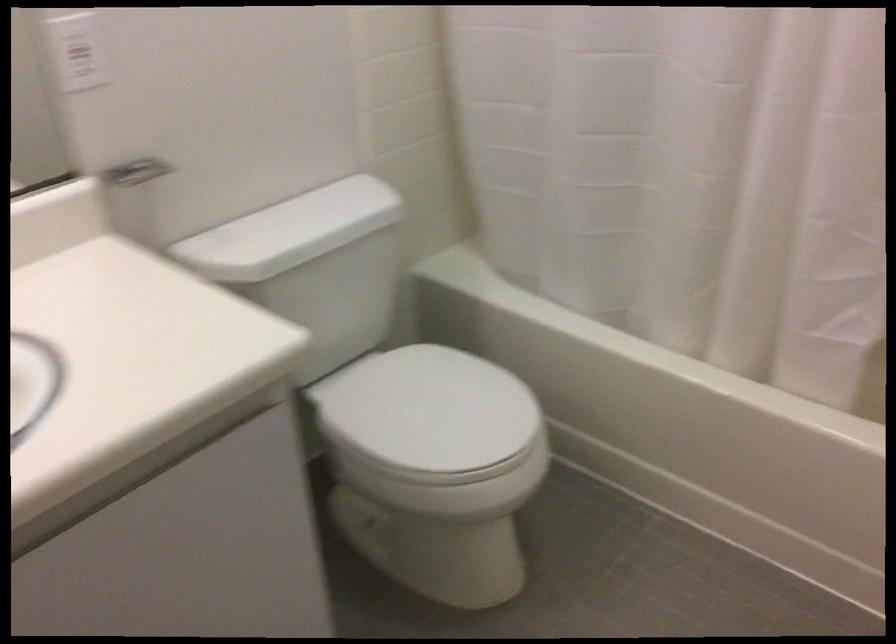
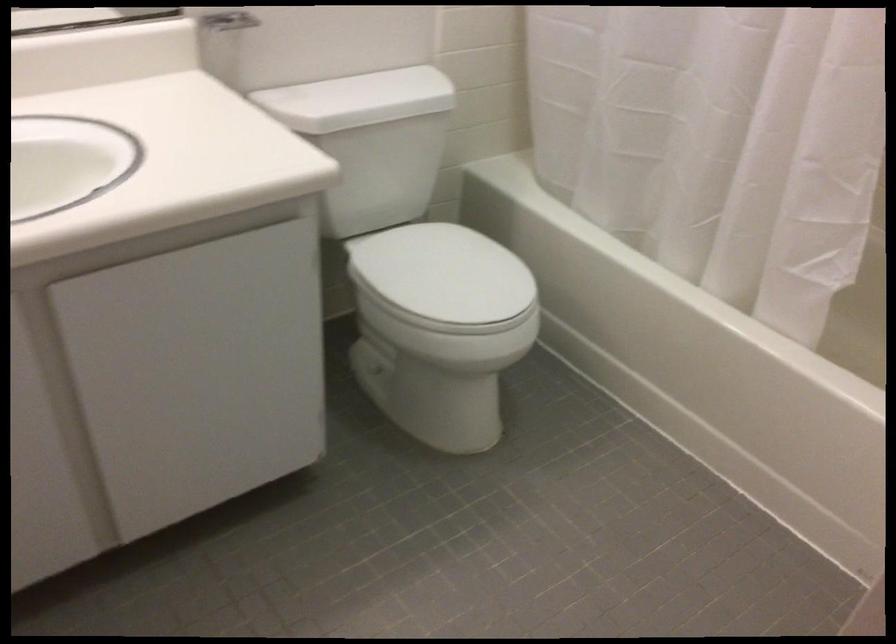
Looking at this image, what movement of the cameraman would produce the second image?

The movement direction of the cameraman is right, backward.